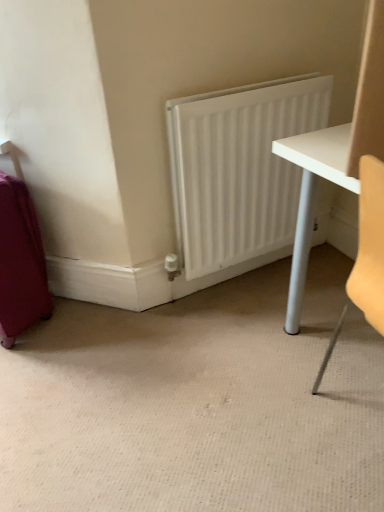
Question: From the image's perspective, does matte purple suitcase at left appear lower than white matte radiator at center?

Choices:
 (A) yes
 (B) no

Answer: (A)

Question: Could you tell me if matte purple suitcase at left is turned towards white matte radiator at center?

Choices:
 (A) no
 (B) yes

Answer: (A)

Question: Is matte purple suitcase at left thinner than white matte radiator at center?

Choices:
 (A) yes
 (B) no

Answer: (B)

Question: From a real-world perspective, does matte purple suitcase at left sit lower than white matte radiator at center?

Choices:
 (A) yes
 (B) no

Answer: (A)

Question: Is matte purple suitcase at left closer to the viewer compared to white matte radiator at center?

Choices:
 (A) yes
 (B) no

Answer: (A)

Question: Is matte purple suitcase at left taller than white matte radiator at center?

Choices:
 (A) yes
 (B) no

Answer: (B)

Question: From the image's perspective, is white matte radiator at center beneath matte purple suitcase at left?

Choices:
 (A) no
 (B) yes

Answer: (A)

Question: Considering the relative sizes of white matte radiator at center and matte purple suitcase at left in the image provided, is white matte radiator at center wider than matte purple suitcase at left?

Choices:
 (A) no
 (B) yes

Answer: (A)

Question: Is white matte radiator at center smaller than matte purple suitcase at left?

Choices:
 (A) no
 (B) yes

Answer: (B)

Question: Is white matte radiator at center taller than matte purple suitcase at left?

Choices:
 (A) no
 (B) yes

Answer: (B)

Question: Could you tell me if white matte radiator at center is facing matte purple suitcase at left?

Choices:
 (A) yes
 (B) no

Answer: (B)

Question: Is white matte radiator at center outside matte purple suitcase at left?

Choices:
 (A) no
 (B) yes

Answer: (B)

Question: Which is correct: white matte radiator at center is inside matte purple suitcase at left, or outside of it?

Choices:
 (A) inside
 (B) outside

Answer: (B)